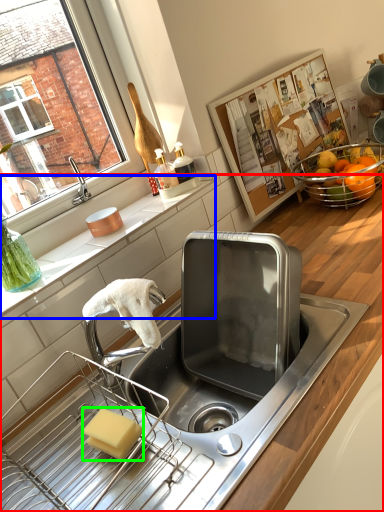
Question: Based on their relative distances, which object is nearer to countertop (highlighted by a red box)? Choose from countertop (highlighted by a blue box) and soap (highlighted by a green box).

Choices:
 (A) countertop
 (B) soap

Answer: (A)